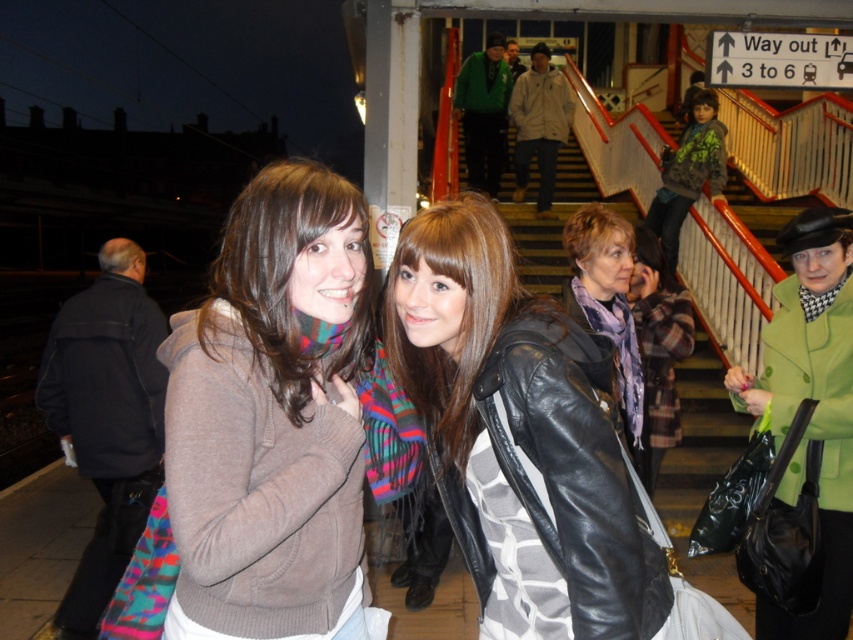
Looking at this image, can you confirm if leather jacket at center is taller than green leather coat at upper right?

No, leather jacket at center is not taller than green leather coat at upper right.

Does leather jacket at center have a smaller size compared to green leather coat at upper right?

Indeed, leather jacket at center has a smaller size compared to green leather coat at upper right.

Which is in front, point (558, 532) or point (817, 355)?

Point (558, 532)

Find the location of `leather jacket at center`. leather jacket at center is located at coordinates (519, 435).

How distant is leather jacket at center from purple scarf at center?

leather jacket at center is 1.69 meters away from purple scarf at center.

Can you confirm if leather jacket at center is smaller than purple scarf at center?

Yes.

What are the coordinates of `leather jacket at center` in the screenshot? It's located at (519, 435).

Is green leather coat at upper right taller than green textured hoodie at upper right?

No, green leather coat at upper right is not taller than green textured hoodie at upper right.

Who is taller, green leather coat at upper right or green textured hoodie at upper right?

green textured hoodie at upper right is taller.

The width and height of the screenshot is (853, 640). In order to click on green leather coat at upper right in this screenshot , I will do pos(811,397).

Locate an element on the screen. green leather coat at upper right is located at coordinates (811, 397).